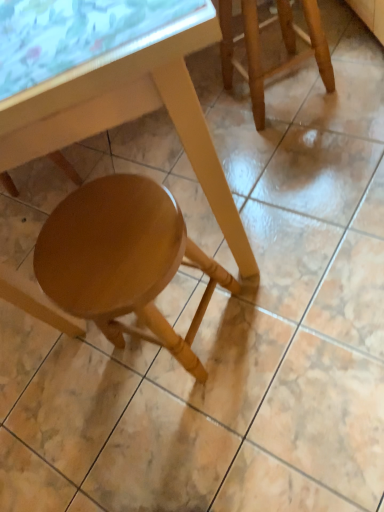
You are a GUI agent. You are given a task and a screenshot of the screen. Output one action in this format:
    pyautogui.click(x=<x>, y=<y>)
    Task: Click on the free spot to the right of glossy wood stool at lower center, which is counted as the 2th stool, starting from the right
    This screenshot has height=512, width=384.
    Given the screenshot: What is the action you would take?
    pyautogui.click(x=284, y=269)